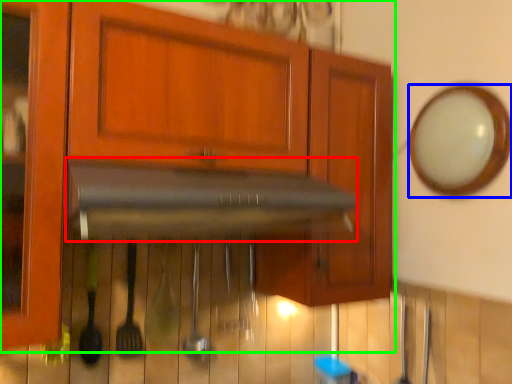
Question: Estimate the real-world distances between objects in this image. Which object is closer to vent (highlighted by a red box), mirror (highlighted by a blue box) or cabinetry (highlighted by a green box)?

Choices:
 (A) mirror
 (B) cabinetry

Answer: (B)